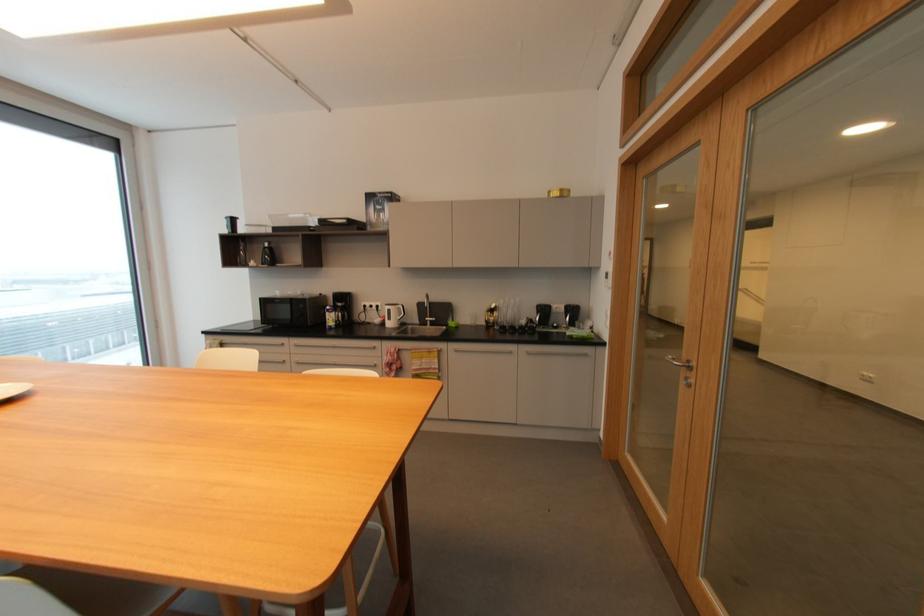
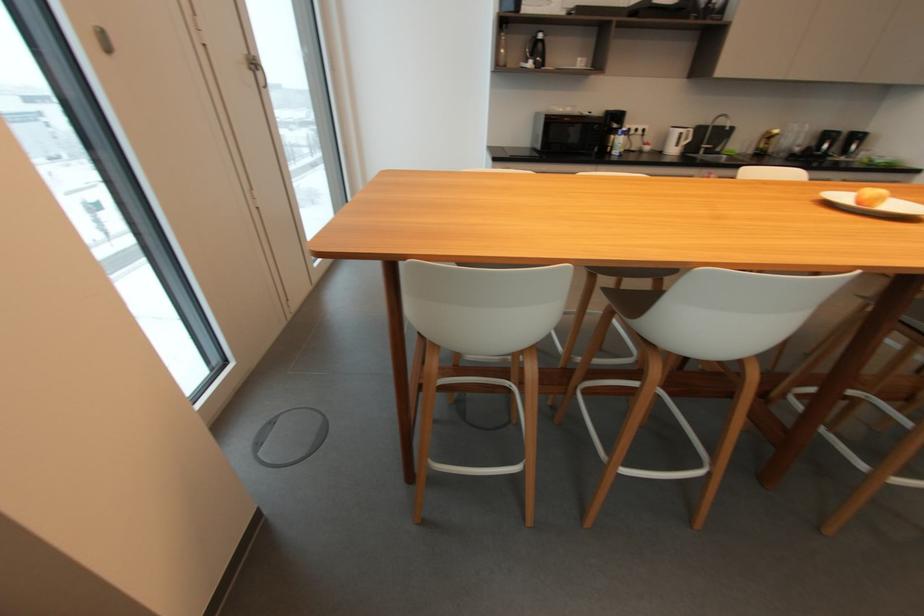
Question: In a continuous first-person perspective shot, in which direction is the camera moving?

Choices:
 (A) Left
 (B) Right
 (C) Forward
 (D) Backward

Answer: (A)